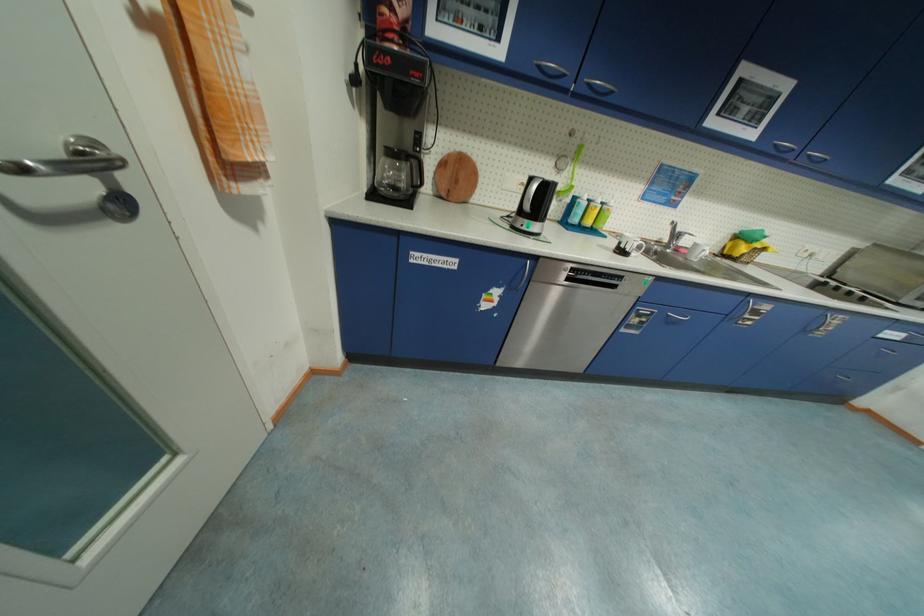
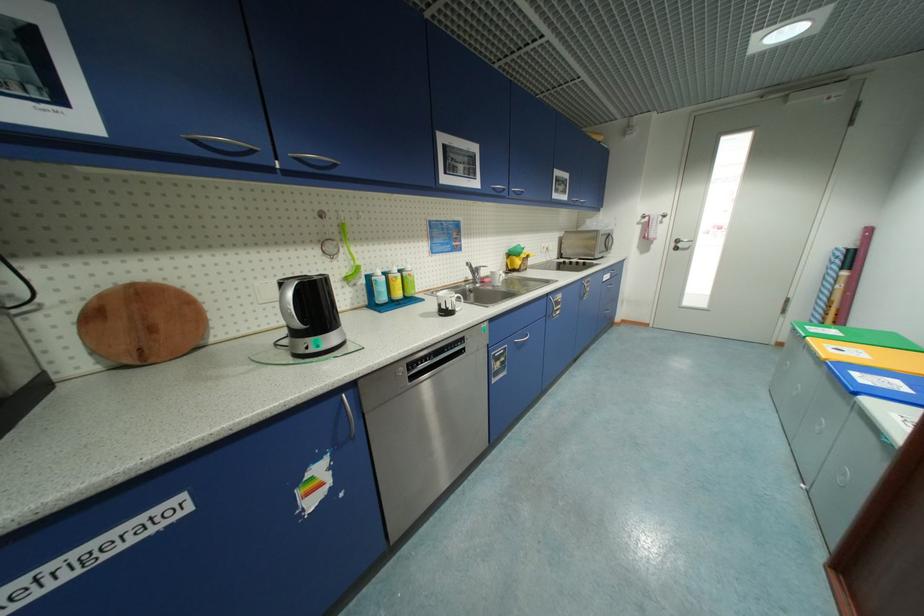
In the second image, find the point that corresponds to pixel 457 151 in the first image.

(114, 286)